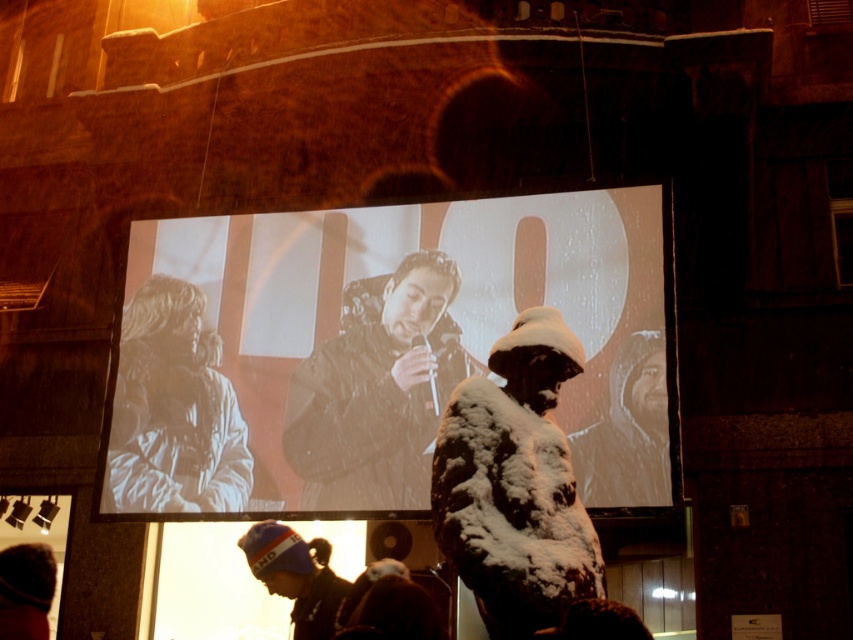
Between point (279, 509) and point (529, 472), which one is positioned in front?

Point (529, 472) is in front.

The height and width of the screenshot is (640, 853). Describe the element at coordinates (376, 349) in the screenshot. I see `matte black jacket at center` at that location.

This screenshot has height=640, width=853. What do you see at coordinates (376, 349) in the screenshot?
I see `matte black jacket at center` at bounding box center [376, 349].

Locate an element on the screen. The height and width of the screenshot is (640, 853). matte black jacket at center is located at coordinates (376, 349).

Looking at this image, is snow-covered statue at center above wet black jacket at center?

Incorrect, snow-covered statue at center is not positioned above wet black jacket at center.

Does snow-covered statue at center have a smaller size compared to wet black jacket at center?

Yes.

Between point (531, 518) and point (416, 394), which one is positioned behind?

Point (416, 394)

The height and width of the screenshot is (640, 853). What are the coordinates of `snow-covered statue at center` in the screenshot? It's located at (515, 484).

Does snow-covered statue at center have a larger size compared to white textured coat at left?

Actually, snow-covered statue at center might be smaller than white textured coat at left.

The height and width of the screenshot is (640, 853). What do you see at coordinates (515, 484) in the screenshot? I see `snow-covered statue at center` at bounding box center [515, 484].

This screenshot has height=640, width=853. Find the location of `snow-covered statue at center`. snow-covered statue at center is located at coordinates (515, 484).